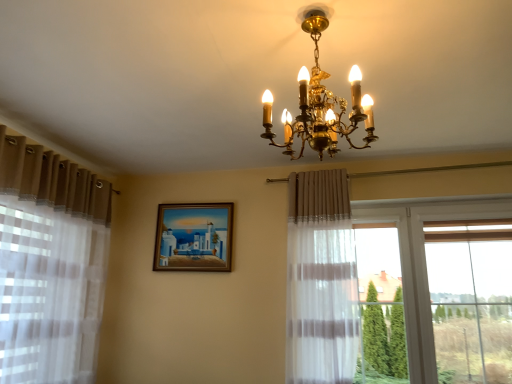
Question: Is the depth of gold metallic chandelier at upper center less than that of wooden framed painting at center?

Choices:
 (A) no
 (B) yes

Answer: (B)

Question: Is the depth of gold metallic chandelier at upper center greater than that of wooden framed painting at center?

Choices:
 (A) yes
 (B) no

Answer: (B)

Question: Is gold metallic chandelier at upper center with wooden framed painting at center?

Choices:
 (A) yes
 (B) no

Answer: (B)

Question: From a real-world perspective, is gold metallic chandelier at upper center below wooden framed painting at center?

Choices:
 (A) yes
 (B) no

Answer: (B)

Question: Is gold metallic chandelier at upper center thinner than wooden framed painting at center?

Choices:
 (A) yes
 (B) no

Answer: (B)

Question: Does gold metallic chandelier at upper center have a smaller size compared to wooden framed painting at center?

Choices:
 (A) no
 (B) yes

Answer: (A)

Question: Is wooden framed painting at center turned away from gold metallic chandelier at upper center?

Choices:
 (A) no
 (B) yes

Answer: (A)

Question: Considering the relative sizes of wooden framed painting at center and gold metallic chandelier at upper center in the image provided, is wooden framed painting at center shorter than gold metallic chandelier at upper center?

Choices:
 (A) yes
 (B) no

Answer: (A)

Question: Is wooden framed painting at center beside gold metallic chandelier at upper center?

Choices:
 (A) no
 (B) yes

Answer: (A)

Question: Would you consider wooden framed painting at center to be distant from gold metallic chandelier at upper center?

Choices:
 (A) yes
 (B) no

Answer: (A)

Question: Does wooden framed painting at center have a larger size compared to gold metallic chandelier at upper center?

Choices:
 (A) no
 (B) yes

Answer: (A)

Question: Does wooden framed painting at center appear on the left side of gold metallic chandelier at upper center?

Choices:
 (A) yes
 (B) no

Answer: (A)

Question: Would you say wooden framed painting at center is to the left or to the right of gold metallic chandelier at upper center in the picture?

Choices:
 (A) right
 (B) left

Answer: (B)